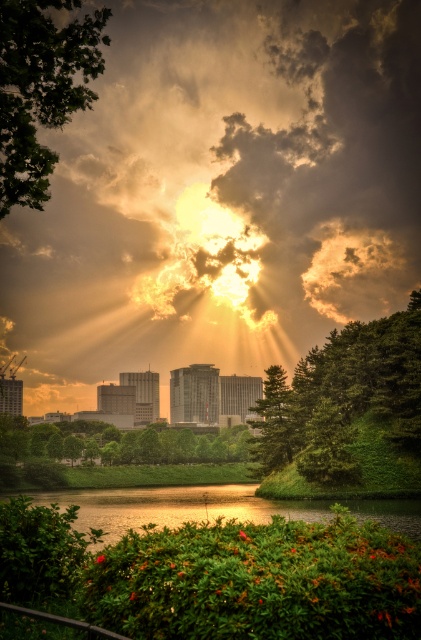
Question: Which point is closer to the camera?

Choices:
 (A) green leafy tree at upper left
 (B) green leafy tree at lower left
 (C) green textured tree at right

Answer: (A)

Question: Can you confirm if golden translucent cloud at upper center is positioned to the right of green textured tree at right?

Choices:
 (A) no
 (B) yes

Answer: (A)

Question: Which of the following is the closest to the observer?

Choices:
 (A) golden translucent cloud at upper center
 (B) glossy reflective water at lower center

Answer: (B)

Question: Is golden translucent cloud at upper center closer to camera compared to green leafy tree at lower left?

Choices:
 (A) yes
 (B) no

Answer: (B)

Question: Considering the relative positions of green leafy tree at upper left and glossy reflective water at lower center in the image provided, where is green leafy tree at upper left located with respect to glossy reflective water at lower center?

Choices:
 (A) below
 (B) above

Answer: (B)

Question: Considering the real-world distances, which object is farthest from the green textured tree at right?

Choices:
 (A) green leafy tree at lower left
 (B) green leafy tree at upper left

Answer: (A)